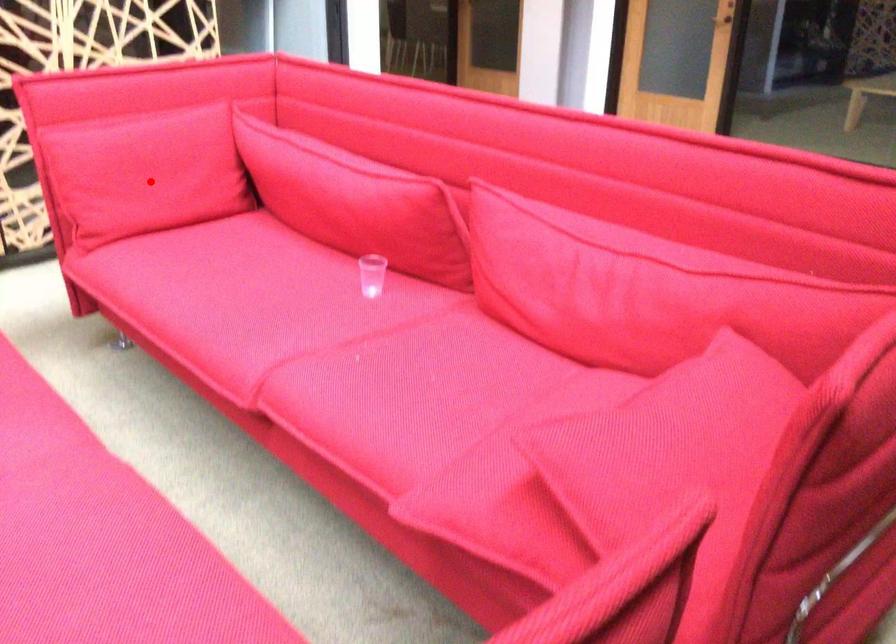
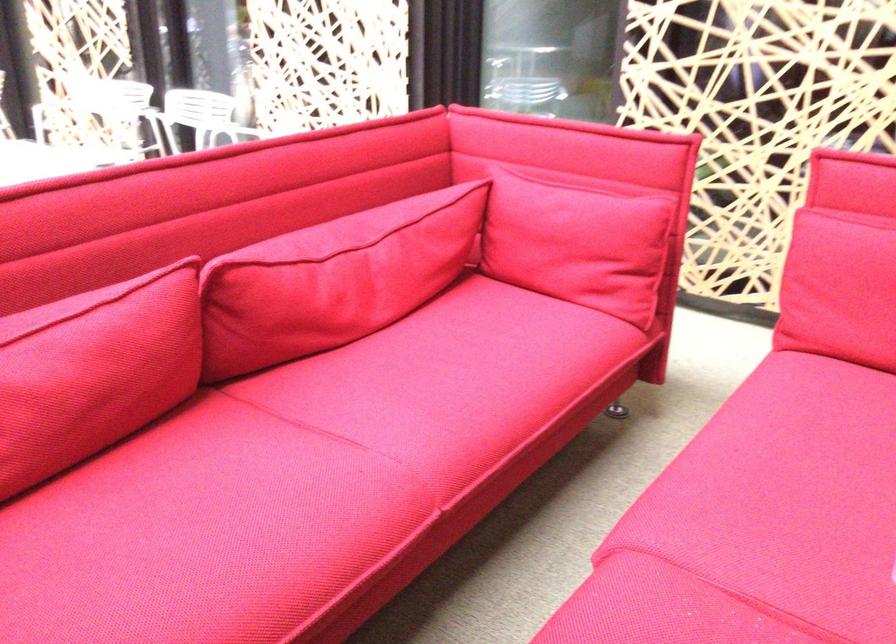
Where in the second image is the point corresponding to the highlighted location from the first image?

(840, 288)